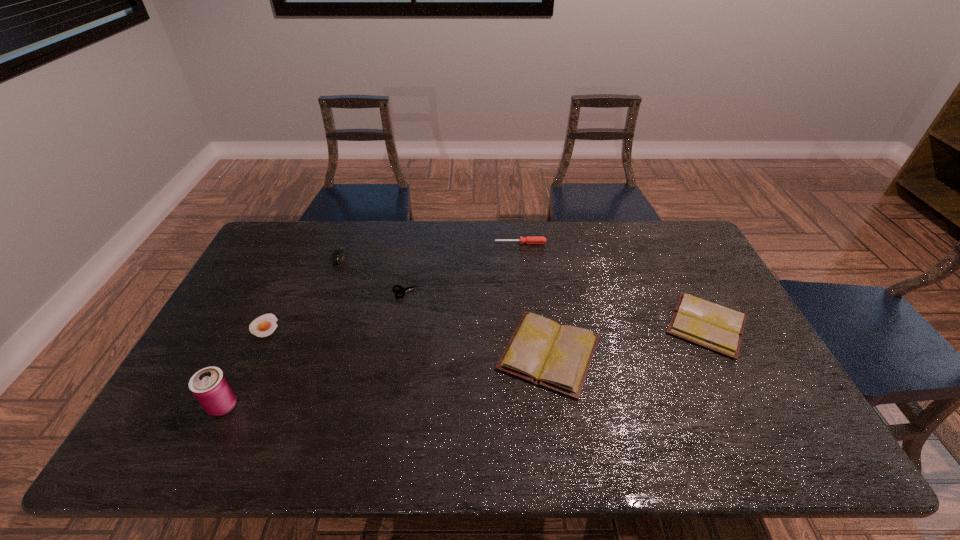
The image size is (960, 540). Identify the location of can situated at the near edge. (210, 386).

Identify the location of egg yolk that is positioned at the left edge. pyautogui.click(x=263, y=326).

You are a GUI agent. You are given a task and a screenshot of the screen. Output one action in this format:
    pyautogui.click(x=<x>, y=<y>)
    Task: Click on the can positioned at the left edge
    Image resolution: width=960 pixels, height=540 pixels.
    Given the screenshot: What is the action you would take?
    pyautogui.click(x=210, y=386)

Where is `object that is at the right edge`? Image resolution: width=960 pixels, height=540 pixels. object that is at the right edge is located at coordinates (709, 325).

What are the coordinates of `object at the near left corner` in the screenshot? It's located at (210, 386).

Locate an element on the screen. The height and width of the screenshot is (540, 960). free region at the far edge is located at coordinates (455, 237).

In the image, there is a desktop. Where is `blank space at the near edge`? Image resolution: width=960 pixels, height=540 pixels. blank space at the near edge is located at coordinates (692, 402).

Locate an element on the screen. The height and width of the screenshot is (540, 960). vacant space at the left edge is located at coordinates (210, 334).

The width and height of the screenshot is (960, 540). Identify the location of vacant area at the right edge. (721, 354).

Find the location of `free space at the far left corner`. free space at the far left corner is located at coordinates (283, 255).